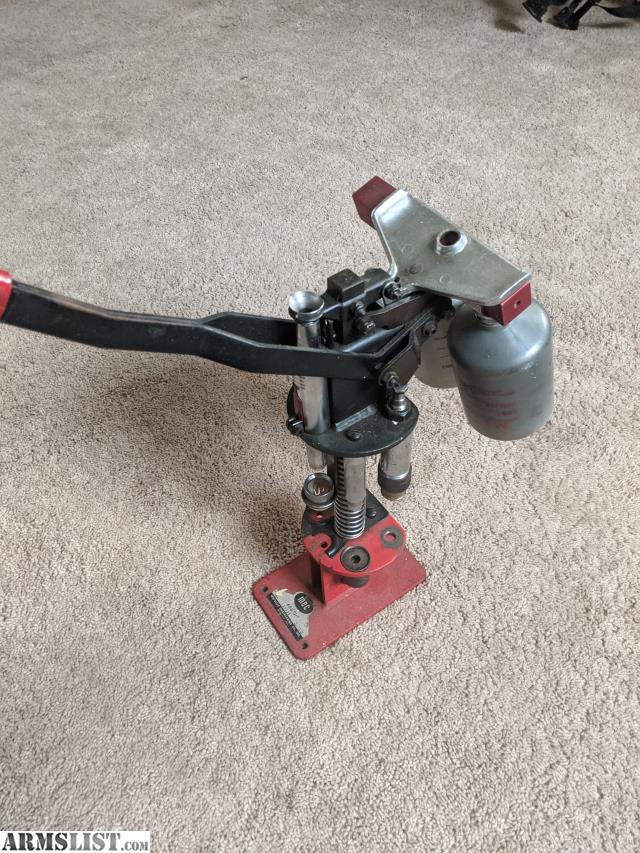
The height and width of the screenshot is (853, 640). What are the coordinates of `screw mounting holes` in the screenshot? It's located at (305, 643), (262, 588).